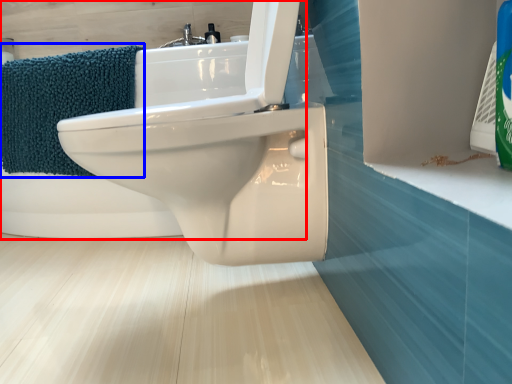
Question: Among these objects, which one is nearest to the camera, bath (highlighted by a red box) or bath towel (highlighted by a blue box)?

Choices:
 (A) bath
 (B) bath towel

Answer: (A)